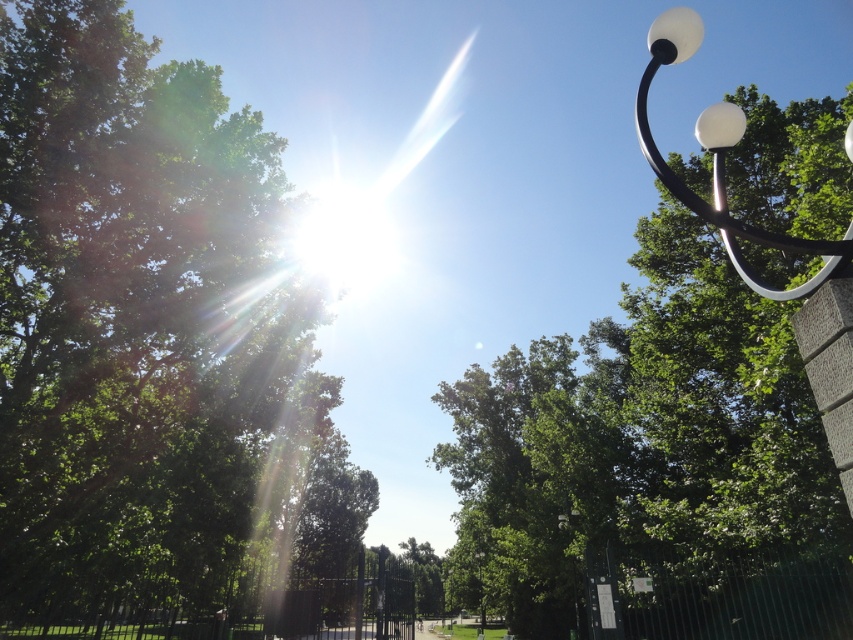
Is point (190, 296) behind point (720, 156)?

Yes, it is.

Describe the element at coordinates (135, 324) in the screenshot. The image size is (853, 640). I see `green leafy tree at upper left` at that location.

At what (x,y) coordinates should I click in order to perform the action: click on green leafy tree at upper left. Please return your answer as a coordinate pair (x, y). The width and height of the screenshot is (853, 640). Looking at the image, I should click on (135, 324).

Between green leafy tree at upper left and green leafy tree at upper center, which one is positioned higher?

green leafy tree at upper center is higher up.

Who is more forward, (x=13, y=134) or (x=805, y=218)?

Point (x=805, y=218) is in front.

Between point (199, 176) and point (770, 536), which one is positioned behind?

The point (199, 176) is more distant.

The image size is (853, 640). What are the coordinates of `green leafy tree at upper left` in the screenshot? It's located at (135, 324).

Which of these two, green leafy tree at upper center or white glossy lamp post at upper right, stands taller?

With more height is green leafy tree at upper center.

Does green leafy tree at upper center have a smaller size compared to white glossy lamp post at upper right?

Actually, green leafy tree at upper center might be larger than white glossy lamp post at upper right.

The height and width of the screenshot is (640, 853). Describe the element at coordinates (636, 436) in the screenshot. I see `green leafy tree at upper center` at that location.

I want to click on green leafy tree at upper center, so click(636, 436).